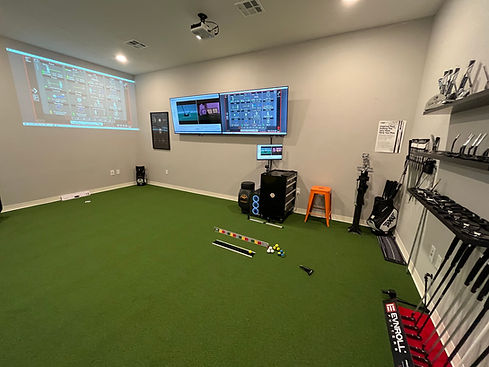
You are a GUI agent. You are given a task and a screenshot of the screen. Output one action in this format:
    pyautogui.click(x=<x>, y=<y>)
    Task: Click on the white poster sign
    The width and height of the screenshot is (489, 367).
    Given the screenshot: What is the action you would take?
    pyautogui.click(x=398, y=131)